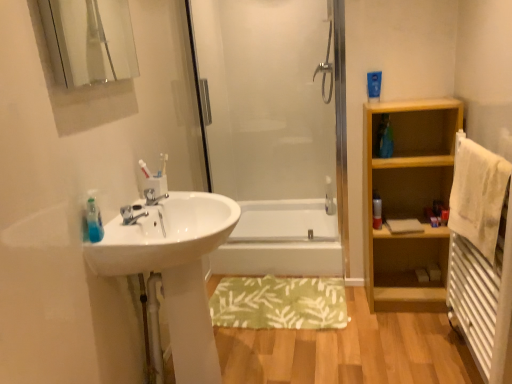
Locate an element on the screen. The image size is (512, 384). vacant position to the left of light wood shelf at right is located at coordinates (360, 314).